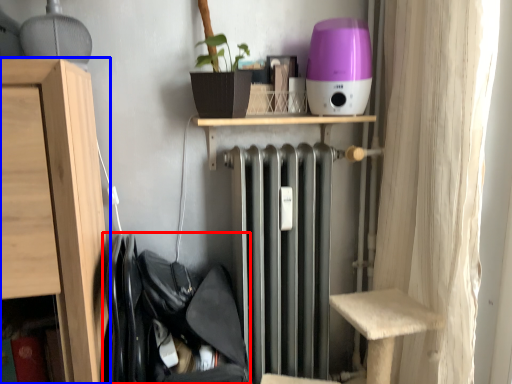
Question: Which object is closer to the camera taking this photo, laundry (highlighted by a red box) or furniture (highlighted by a blue box)?

Choices:
 (A) laundry
 (B) furniture

Answer: (B)